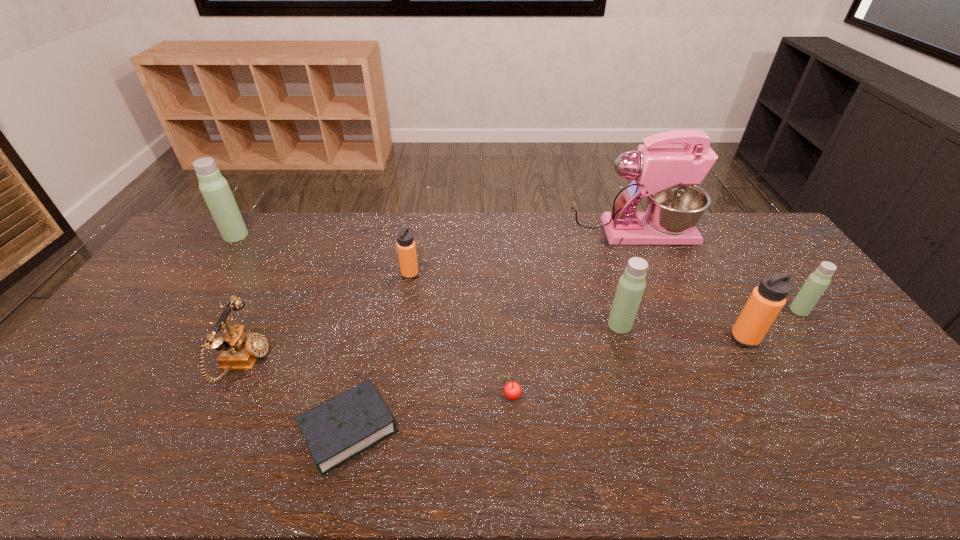
Identify the location of the tallest object. The width and height of the screenshot is (960, 540). (667, 174).

Locate an element on the screen. The width and height of the screenshot is (960, 540). the second tallest object is located at coordinates (214, 188).

Locate an element on the screen. This screenshot has width=960, height=540. the leftmost thermos bottle is located at coordinates (214, 188).

Identify the location of the fourth thermos bottle from left to right. This screenshot has height=540, width=960. (766, 301).

Image resolution: width=960 pixels, height=540 pixels. Identify the location of the nearer orange thermos bottle. (766, 301).

Find the location of a particular element. the second light thermos bottle from left to right is located at coordinates (631, 285).

You are a GUI agent. You are given a task and a screenshot of the screen. Output one action in this format:
    pyautogui.click(x=<x>, y=<y>)
    Task: Click on the third thermos bottle from right to left
    Image resolution: width=960 pixels, height=540 pixels.
    Given the screenshot: What is the action you would take?
    pyautogui.click(x=631, y=285)

In order to click on the smallest light thermos bottle in this screenshot , I will do `click(818, 281)`.

Find the location of `the rightmost thermos bottle`. the rightmost thermos bottle is located at coordinates (818, 281).

The width and height of the screenshot is (960, 540). Identify the location of the second thermos bottle from left to right. (406, 248).